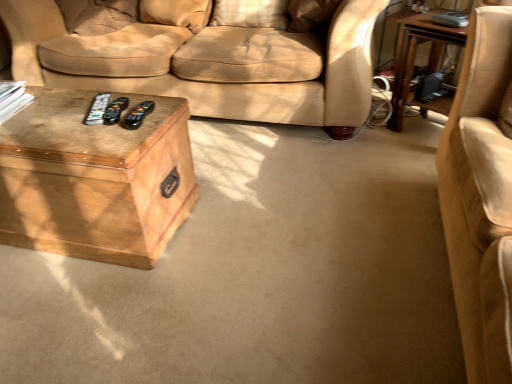
The image size is (512, 384). Find the location of `vacant space in between wooden trunk at lower left, which is the second table in right-to-left order, and wooden table at right, the second table when ordered from left to right`. vacant space in between wooden trunk at lower left, which is the second table in right-to-left order, and wooden table at right, the second table when ordered from left to right is located at coordinates (286, 165).